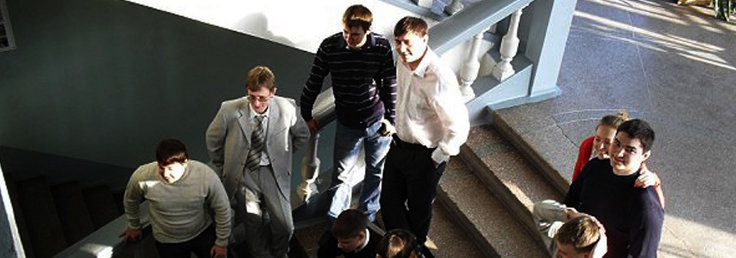
Image resolution: width=736 pixels, height=258 pixels. I want to click on stairs, so pos(470,209), pos(512,183).